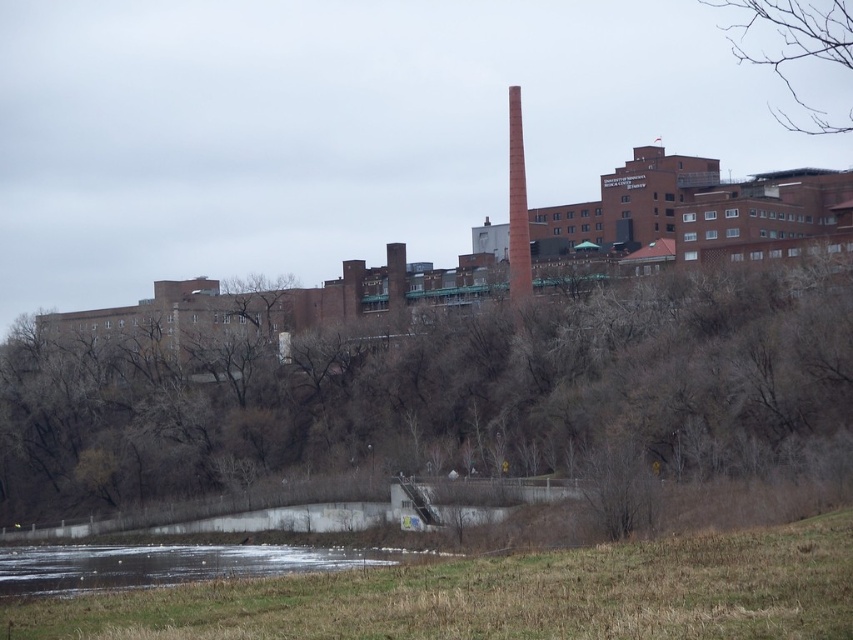
Looking at this image, you are an environmental inspector assessing the industrial complex. You notice the brown leafless trees at upper center and the bare branches at upper right in the scene. Which of these two features is closer to your current position?

The brown leafless trees at upper center are closer to your current position because they are positioned in front of the bare branches at upper right.

You are a photographer standing at the base of the industrial complex. You want to capture a photo of the brown leafless trees at upper center in your shot. Considering your camera has a maximum focus range of 75 meters, will you be able to focus on the trees without moving closer?

The brown leafless trees at upper center is 77.16 meters from camera, which exceeds the camera maximum focus range of 75 meters. Therefore, you cannot focus on the trees without moving closer.

You are an architect reviewing the layout of the industrial complex. You notice the brown leafless trees at upper center and the red brick chimney at upper right. Which object is positioned to the east of the other?

The brown leafless trees at upper center is to the left of red brick chimney at upper right. Since in an image, left typically corresponds to east if the scene is facing north, the brown leafless trees at upper center would be positioned to the east of the red brick chimney at upper right.